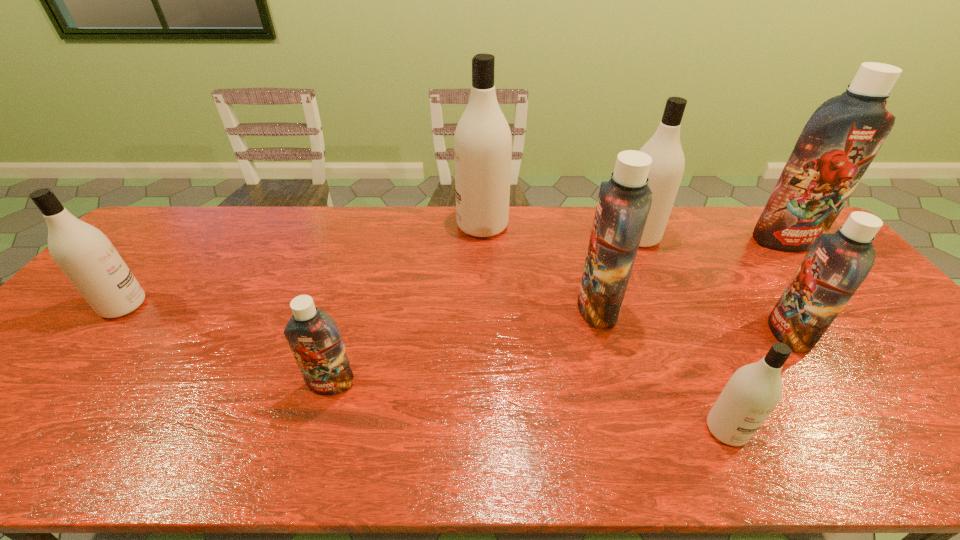
This screenshot has height=540, width=960. What are the coordinates of `object that is at the near edge` in the screenshot? It's located at (751, 394).

Locate an element on the screen. object located at the left edge is located at coordinates (87, 257).

Find the location of `object that is positioned at the right edge`. object that is positioned at the right edge is located at coordinates (842, 137).

Locate an element on the screen. The image size is (960, 540). object positioned at the far right corner is located at coordinates (842, 137).

Find the location of a particular element. This screenshot has width=960, height=540. free location at the far edge is located at coordinates (331, 220).

This screenshot has width=960, height=540. Identify the location of vacant space at the near edge of the desktop. (159, 446).

Identify the location of vacant area at the left edge. The image size is (960, 540). (24, 413).

In the image, there is a desktop. Where is `vacant space at the far left corner`? The width and height of the screenshot is (960, 540). vacant space at the far left corner is located at coordinates (180, 242).

Where is `vacant area that lies between the sixth object from right to left and the second nearest object`? The image size is (960, 540). vacant area that lies between the sixth object from right to left and the second nearest object is located at coordinates (407, 305).

Find the location of a particular element. The height and width of the screenshot is (540, 960). blank region between the nearest shampoo and the rightmost object is located at coordinates click(x=756, y=335).